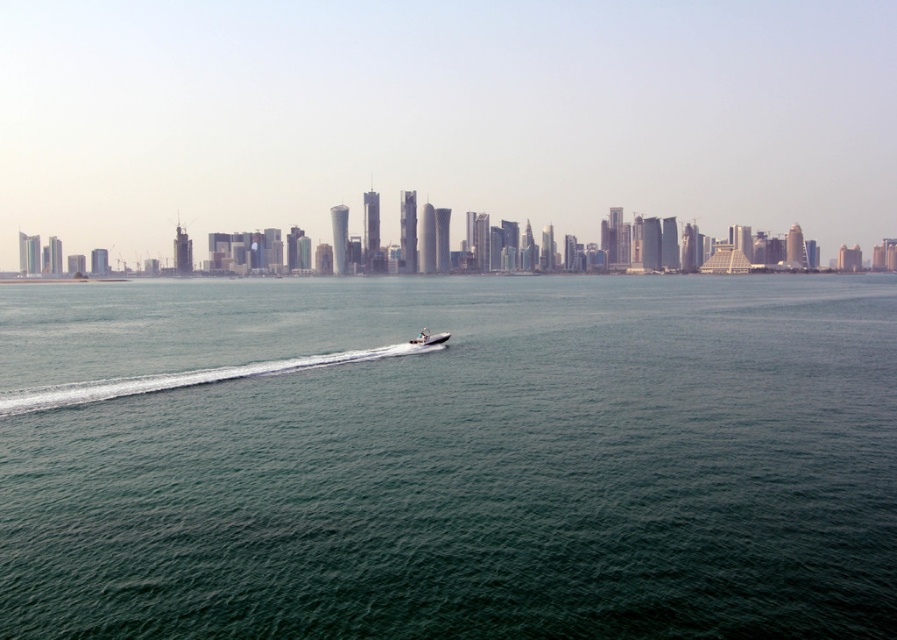
You are a photographer planning to capture the city skyline reflected in the green water at center. However, you notice the white glossy boat at center might disrupt the reflection. Based on their sizes, which object would dominate the reflection, and why?

The green water at center has a larger size compared to the white glossy boat at center, so the reflection of the city skyline would be dominated by the green water at center as it occupies more space in the frame.

You are a drone operator trying to capture a photo of the green water at center from above. What are the coordinates where you should aim your drone?

The coordinates for the green water at center are at point (449, 458).

You are standing on a pier overlooking the city skyline. You want to estimate how far the green water at center is from your current position. Based on the scene, can you determine the distance?

The green water at center is 67.04 feet away from the camera, so the distance from your current position on the pier to the green water at center is approximately 67.04 feet.